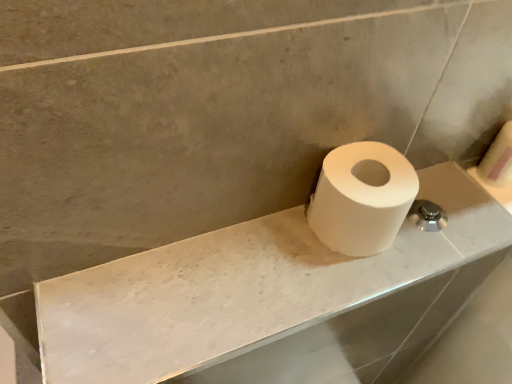
This screenshot has width=512, height=384. What are the coordinates of `blank space situated above white marble counter top at center (from a real-world perspective)` in the screenshot? It's located at (271, 269).